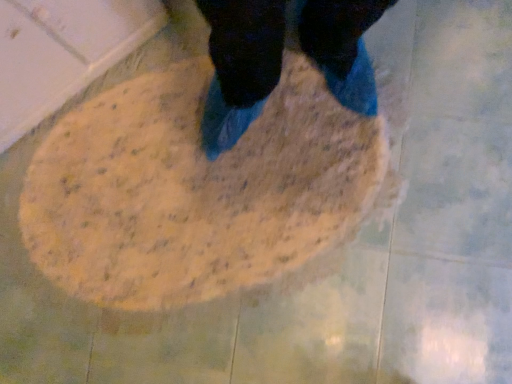
This screenshot has height=384, width=512. What are the coordinates of `free space above beige textured rug at center (from a real-world perspective)` in the screenshot? It's located at (210, 178).